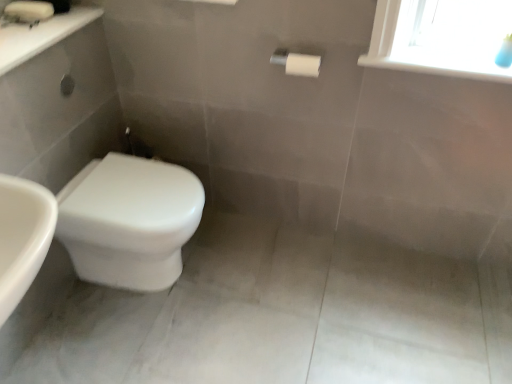
Where is `free space in front of white glossy toilet at lower left`? This screenshot has width=512, height=384. free space in front of white glossy toilet at lower left is located at coordinates (134, 342).